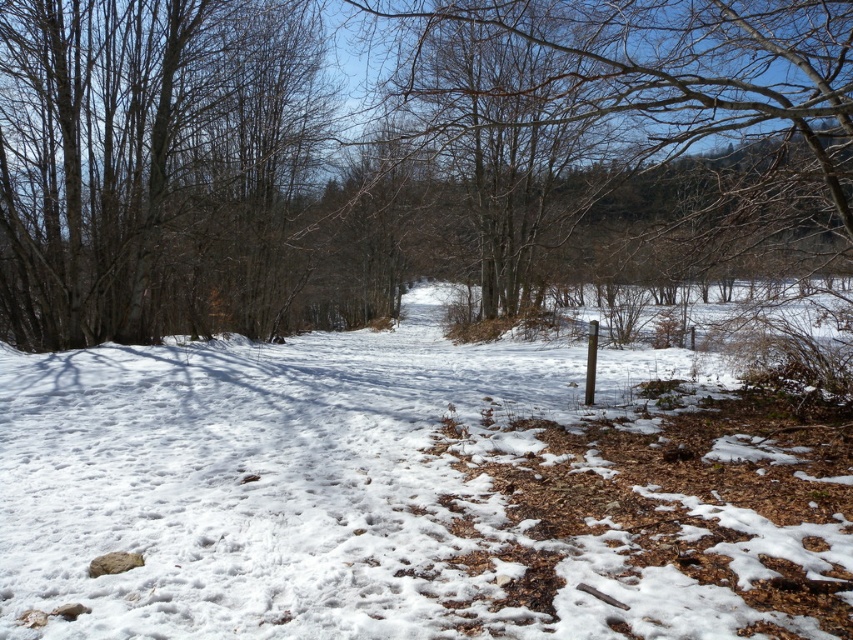
Question: Does brown/dry wood at center have a lesser width compared to white powdery snow at center?

Choices:
 (A) no
 (B) yes

Answer: (A)

Question: Which of the following is the closest to the observer?

Choices:
 (A) white powdery snow at center
 (B) brown/dry wood at center

Answer: (A)

Question: Which point is farther to the camera?

Choices:
 (A) white powdery snow at center
 (B) brown/dry wood at center

Answer: (B)

Question: Is brown/dry wood at center in front of white powdery snow at center?

Choices:
 (A) yes
 (B) no

Answer: (B)

Question: Among these points, which one is nearest to the camera?

Choices:
 (A) tap(409, 445)
 (B) tap(155, 284)

Answer: (A)

Question: Can you confirm if brown/dry wood at center is smaller than white powdery snow at center?

Choices:
 (A) no
 (B) yes

Answer: (A)